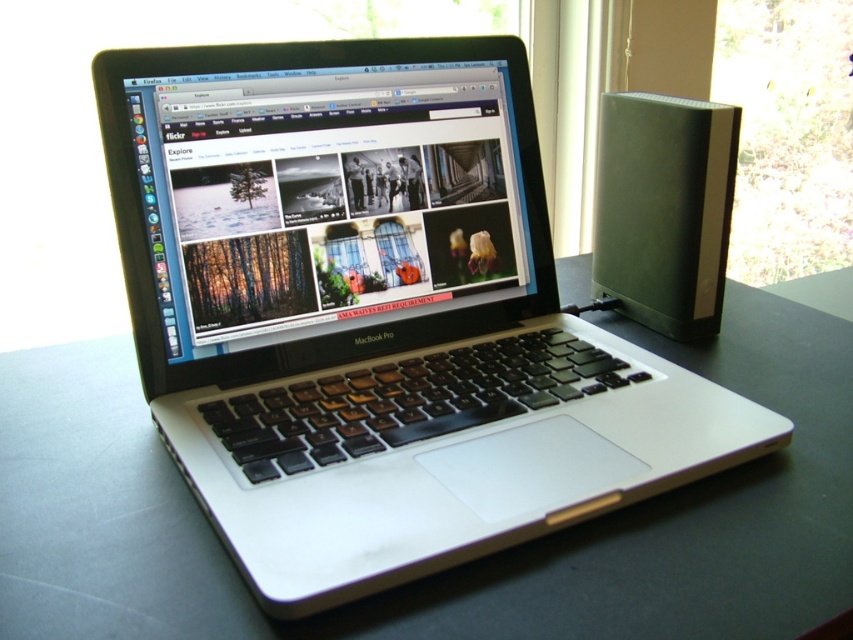
How much distance is there between satin black laptop at center and transparent glass window at upper right?

satin black laptop at center is 1.02 meters from transparent glass window at upper right.

Which is more to the right, satin black laptop at center or transparent glass window at upper right?

transparent glass window at upper right

Does point (115, 108) come behind point (741, 44)?

No, it is in front of (741, 44).

In order to click on satin black laptop at center in this screenshot , I will do `click(320, 200)`.